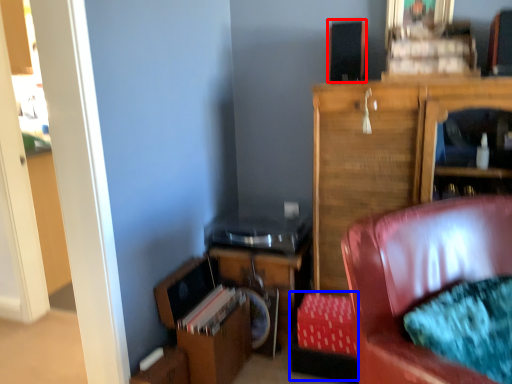
Question: Among these objects, which one is farthest to the camera, speaker (highlighted by a red box) or footrest (highlighted by a blue box)?

Choices:
 (A) speaker
 (B) footrest

Answer: (A)